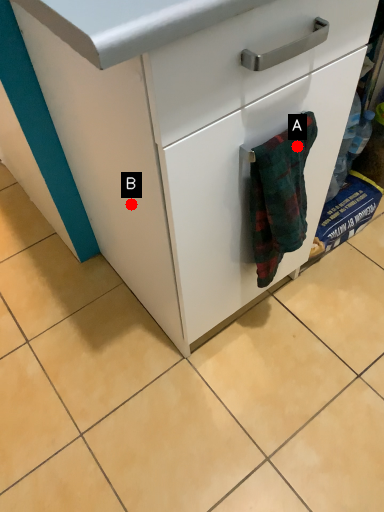
Question: Two points are circled on the image, labeled by A and B beside each circle. Which point is further to the camera?

Choices:
 (A) A is further
 (B) B is further

Answer: (B)